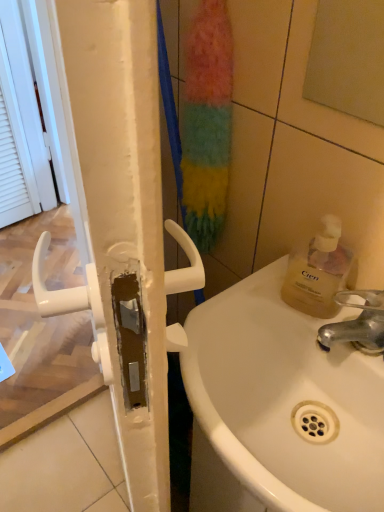
Question: Considering the relative positions of translucent yellow liquid at sink right and matte glass mirror at upper right in the image provided, is translucent yellow liquid at sink right to the right of matte glass mirror at upper right from the viewer's perspective?

Choices:
 (A) no
 (B) yes

Answer: (A)

Question: Is translucent yellow liquid at sink right bigger than matte glass mirror at upper right?

Choices:
 (A) no
 (B) yes

Answer: (A)

Question: From a real-world perspective, does translucent yellow liquid at sink right stand above matte glass mirror at upper right?

Choices:
 (A) yes
 (B) no

Answer: (B)

Question: Is translucent yellow liquid at sink right directly adjacent to matte glass mirror at upper right?

Choices:
 (A) no
 (B) yes

Answer: (A)

Question: Considering the relative sizes of translucent yellow liquid at sink right and matte glass mirror at upper right in the image provided, is translucent yellow liquid at sink right smaller than matte glass mirror at upper right?

Choices:
 (A) no
 (B) yes

Answer: (B)

Question: From the image's perspective, is white glossy sink at center positioned above or below white plastic screen door at left?

Choices:
 (A) above
 (B) below

Answer: (B)

Question: Is white glossy sink at center in front of or behind white plastic screen door at left in the image?

Choices:
 (A) behind
 (B) front

Answer: (B)

Question: Based on their positions, is white glossy sink at center located to the left or right of white plastic screen door at left?

Choices:
 (A) right
 (B) left

Answer: (A)

Question: Is point (307, 331) positioned closer to the camera than point (81, 232)?

Choices:
 (A) closer
 (B) farther

Answer: (A)

Question: Considering the positions of white plastic screen door at left and matte glass mirror at upper right in the image, is white plastic screen door at left bigger or smaller than matte glass mirror at upper right?

Choices:
 (A) big
 (B) small

Answer: (A)

Question: Considering their positions, is white plastic screen door at left located in front of or behind matte glass mirror at upper right?

Choices:
 (A) behind
 (B) front

Answer: (A)

Question: Would you say white plastic screen door at left is inside or outside matte glass mirror at upper right?

Choices:
 (A) inside
 (B) outside

Answer: (B)

Question: Is point (9, 284) closer or farther from the camera than point (342, 76)?

Choices:
 (A) closer
 (B) farther

Answer: (B)

Question: Considering their positions, is white plastic handle at left located in front of or behind white glossy sink at center?

Choices:
 (A) front
 (B) behind

Answer: (A)

Question: Would you say white plastic handle at left is to the left or to the right of white glossy sink at center in the picture?

Choices:
 (A) left
 (B) right

Answer: (A)